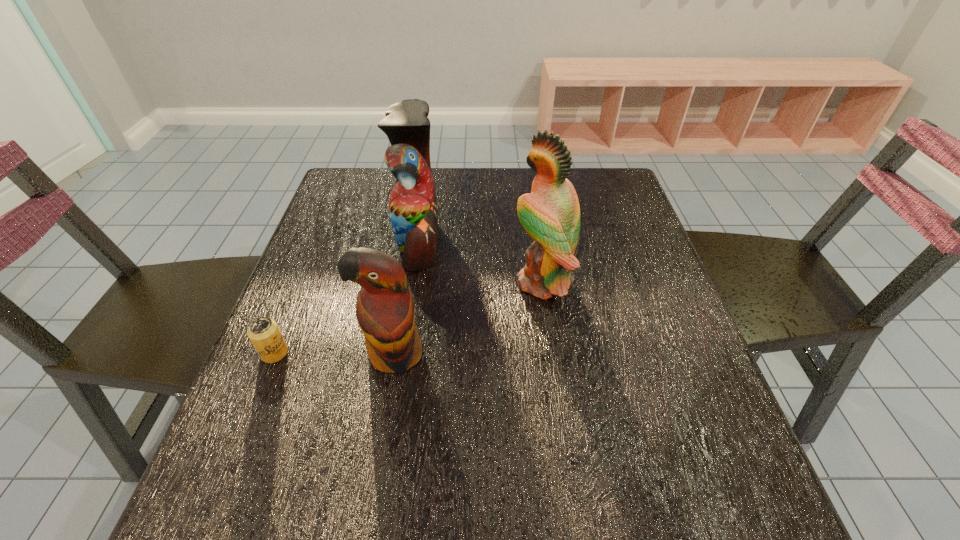
At what (x,y) coordinates should I click in order to perform the action: click on the rightmost parrot. Please return your answer as a coordinate pair (x, y). Looking at the image, I should click on (550, 214).

Find the location of a particular element. The image size is (960, 540). the nearest parrot is located at coordinates (385, 310).

Identify the location of the leftmost object. The height and width of the screenshot is (540, 960). (264, 333).

Where is `the shortest object`? The height and width of the screenshot is (540, 960). the shortest object is located at coordinates (264, 333).

The width and height of the screenshot is (960, 540). In order to click on free space located 0.380m on the front-facing side of the rightmost parrot in this screenshot , I will do `click(349, 282)`.

This screenshot has width=960, height=540. Identify the location of free point located 0.350m on the front-facing side of the rightmost parrot. (362, 282).

Identify the location of vacant point located on the front-facing side of the rightmost parrot. (422, 282).

At what (x,y) coordinates should I click in order to perform the action: click on free space located 0.130m on the face of the nearest parrot. Please return your answer as a coordinate pair (x, y). The width and height of the screenshot is (960, 540). Looking at the image, I should click on (378, 450).

You are a GUI agent. You are given a task and a screenshot of the screen. Output one action in this format:
    pyautogui.click(x=<x>, y=<y>)
    Task: Click on the vacant space located on the back of the beer can
    Image resolution: width=960 pixels, height=540 pixels.
    Given the screenshot: What is the action you would take?
    pyautogui.click(x=292, y=309)

Locate an element on the screen. object present at the left edge is located at coordinates (264, 333).